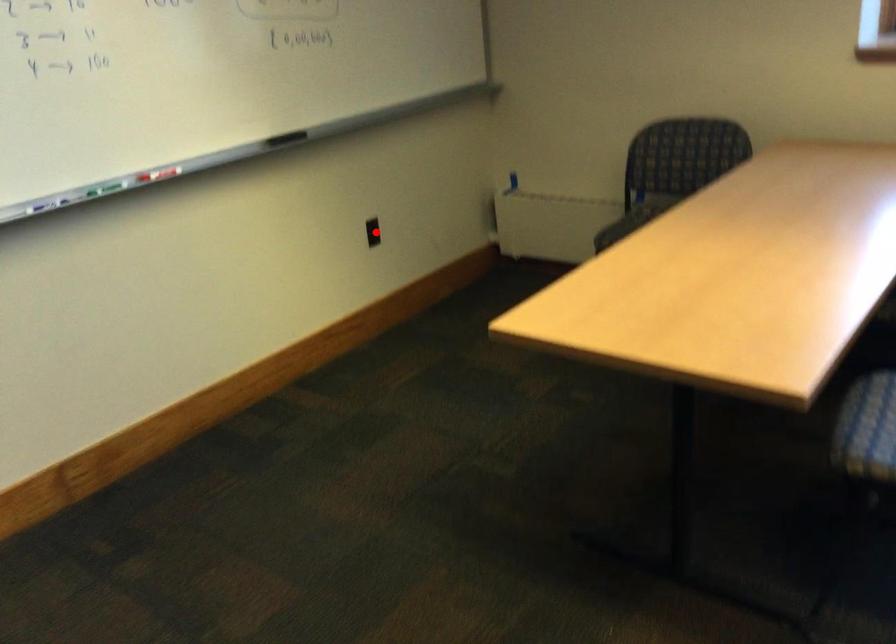
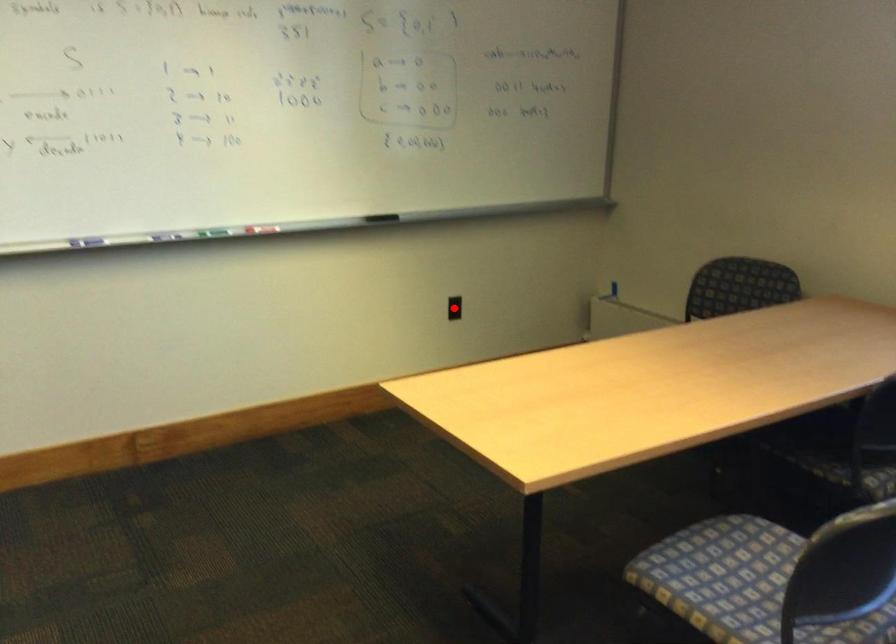
I am providing you with two images of the same scene from different viewpoints. A red point is marked on the first image and another point is marked on the second image. Do the highlighted points in image1 and image2 indicate the same real-world spot?

Yes